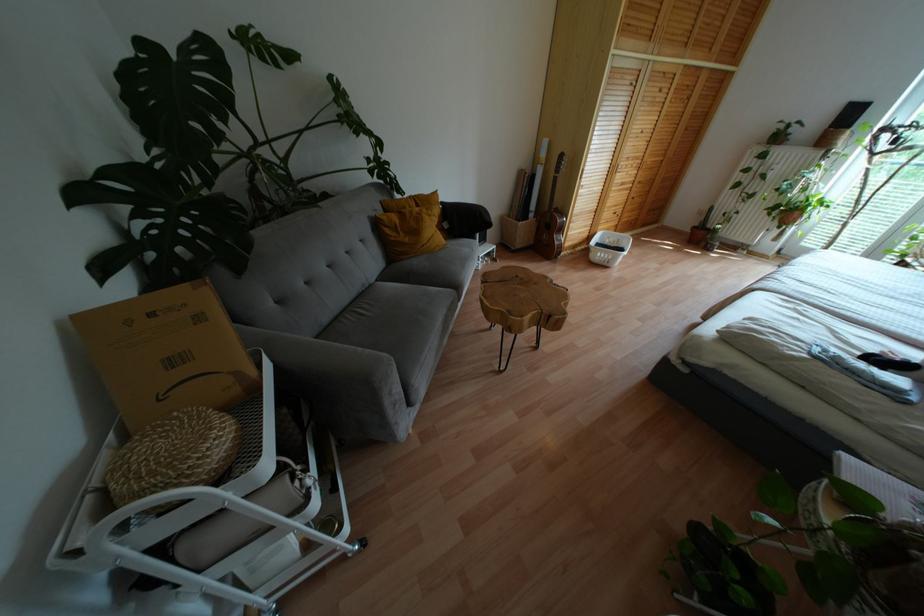
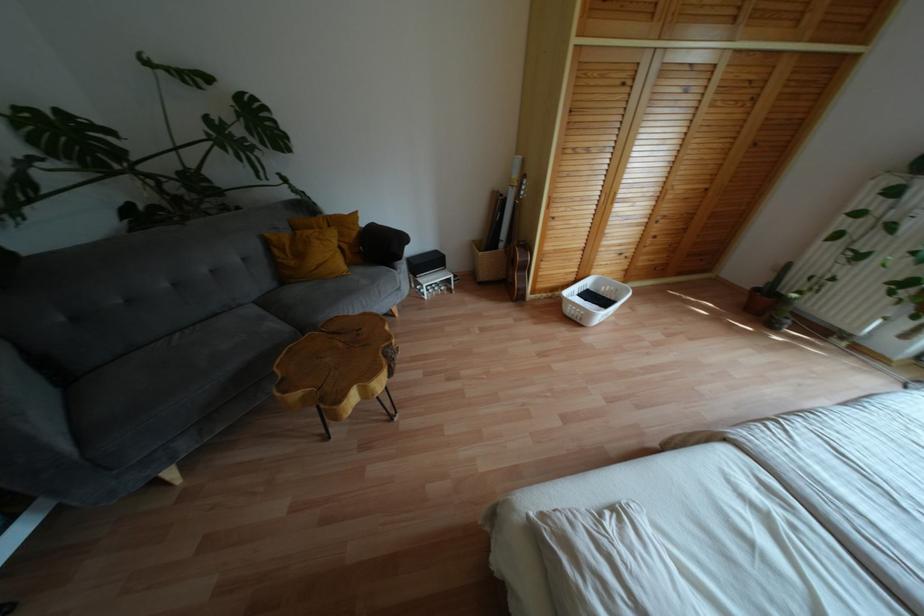
The point at (601, 262) is marked in the first image. Where is the corresponding point in the second image?

(573, 318)